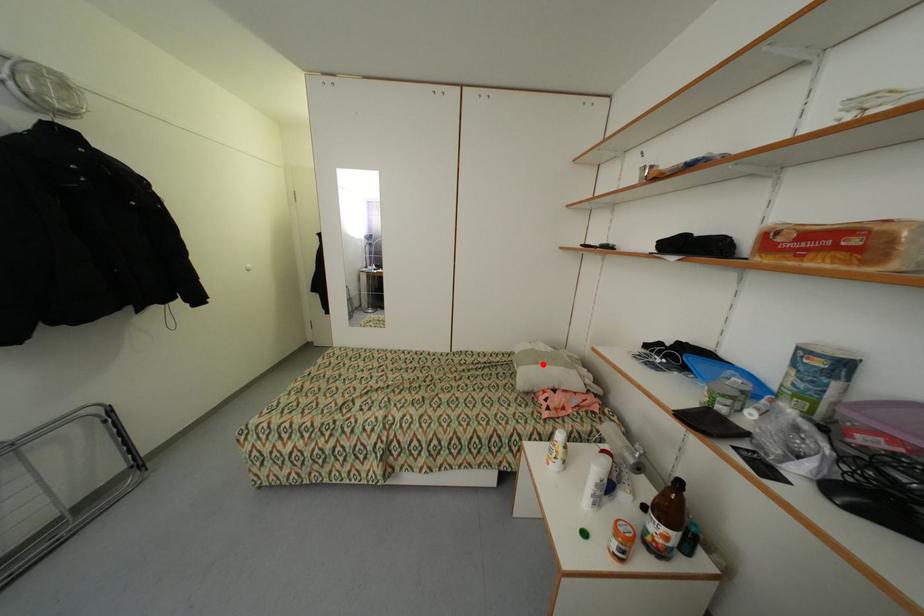
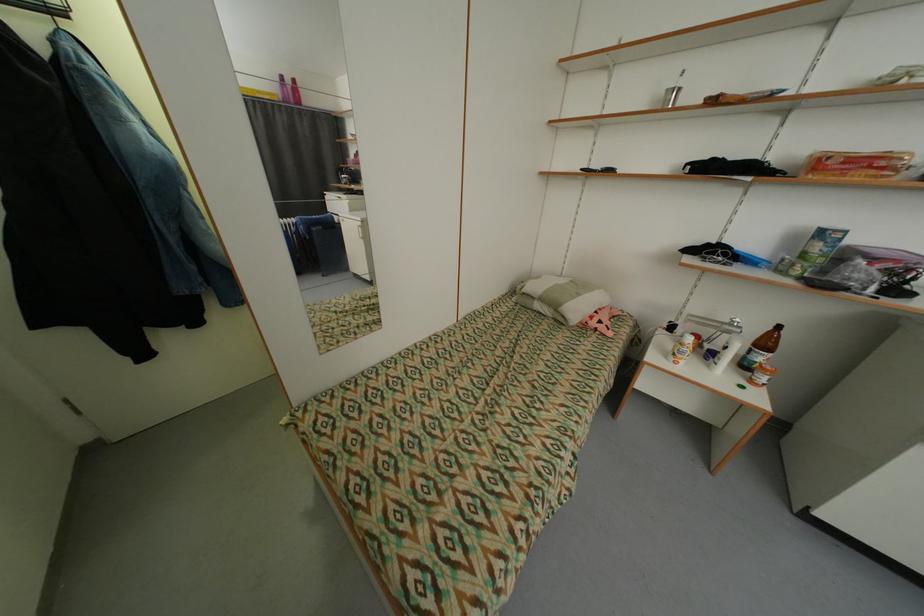
Find the pixel in the second image that matches the highlighted location in the first image.

(585, 296)